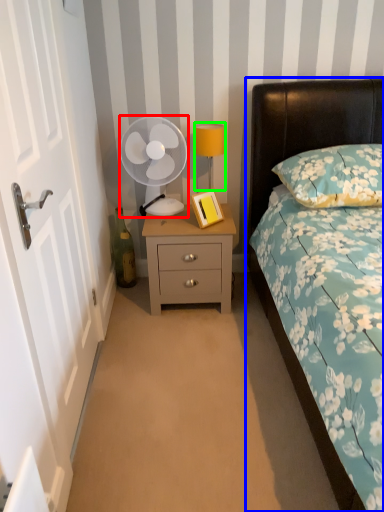
Question: Which object is positioned farthest from mechanical fan (highlighted by a red box)? Select from bed (highlighted by a blue box) and bedside lamp (highlighted by a green box).

Choices:
 (A) bed
 (B) bedside lamp

Answer: (A)